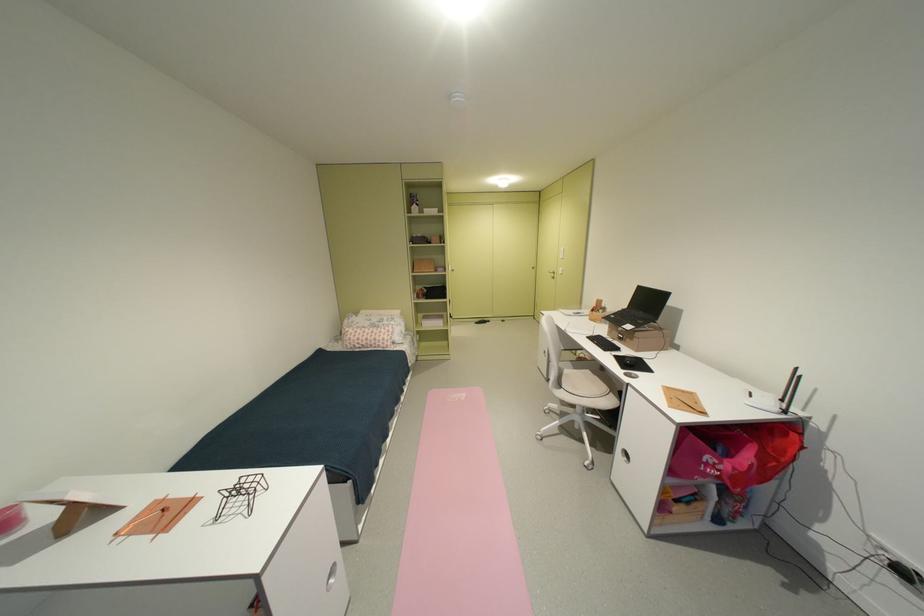
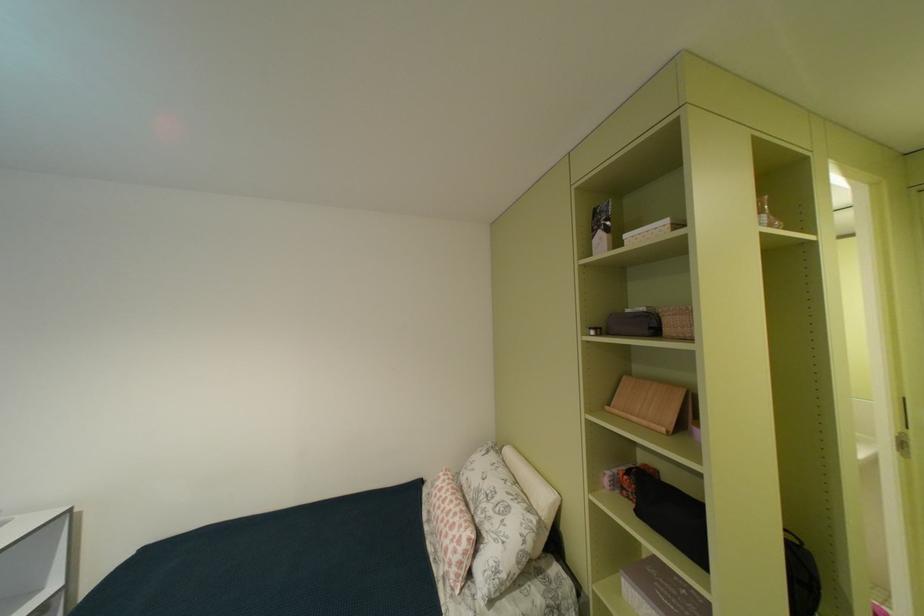
Where in the second image is the point corresponding to pixel 432 300 from the first image?

(641, 501)